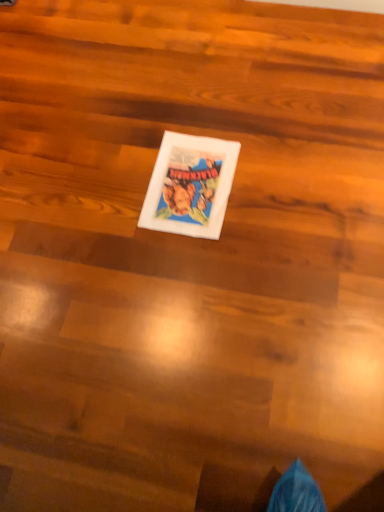
Where is `vacant space situated above white matte comic book at center (from a real-world perspective)`? Image resolution: width=384 pixels, height=512 pixels. vacant space situated above white matte comic book at center (from a real-world perspective) is located at coordinates (189, 178).